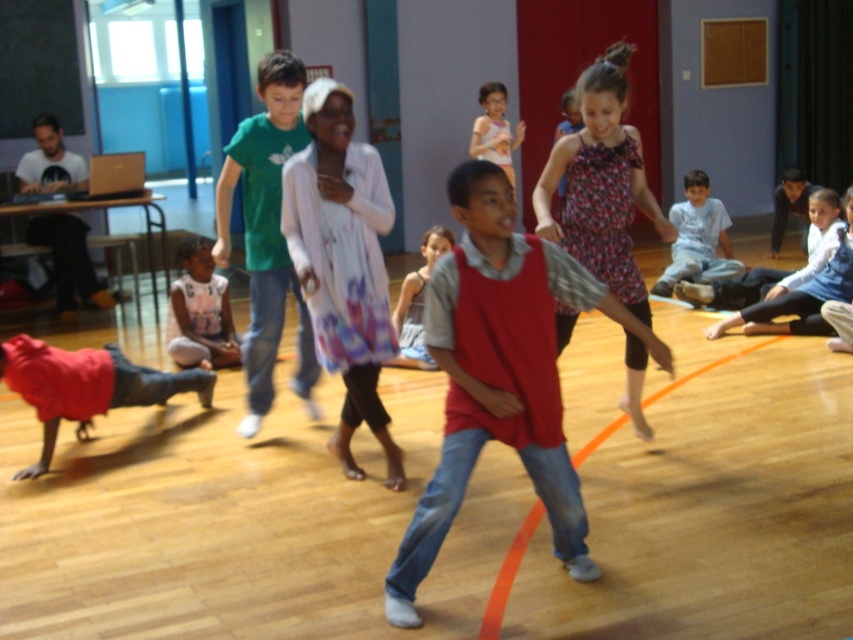
Is floral dress at center bigger than white cotton shirt at upper center?

Yes, floral dress at center is bigger than white cotton shirt at upper center.

Is floral dress at center smaller than white cotton shirt at upper center?

No.

Describe the element at coordinates (601, 184) in the screenshot. I see `floral dress at center` at that location.

Locate an element on the screen. This screenshot has width=853, height=640. floral dress at center is located at coordinates (601, 184).

How distant is white cotton shirt at lower left from white cotton shirt at upper center?

The distance of white cotton shirt at lower left from white cotton shirt at upper center is 5.02 meters.

Which of these two, white cotton shirt at lower left or white cotton shirt at upper center, stands taller?

white cotton shirt at upper center

What do you see at coordinates (200, 310) in the screenshot?
I see `white cotton shirt at lower left` at bounding box center [200, 310].

Find the location of a particular element. This screenshot has width=853, height=640. white cotton shirt at lower left is located at coordinates (200, 310).

Can you confirm if green cotton t-shirt at center is thinner than light blue cotton shirt at center?

Yes, green cotton t-shirt at center is thinner than light blue cotton shirt at center.

Where is `green cotton t-shirt at center`? green cotton t-shirt at center is located at coordinates (265, 230).

Where is `green cotton t-shirt at center`? green cotton t-shirt at center is located at coordinates (265, 230).